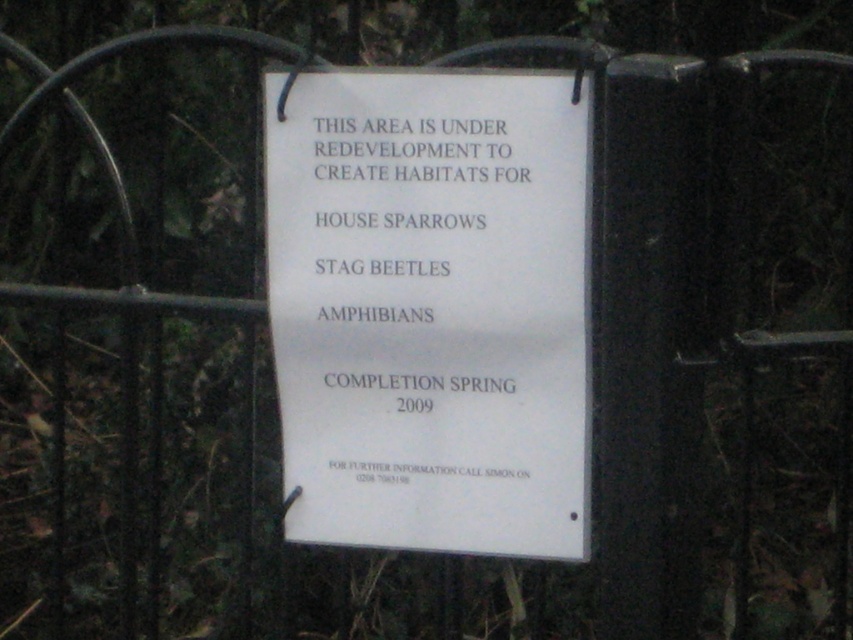
You are a contractor working on the redevelopment project mentioned on the sign. You need to attach a new notice to the fence, but you must ensure it doesn not overlap with the existing white paper sign at center or the white paper at center. Given that the new notice is 1 inch wide, what is the minimum spacing you should leave between the new notice and the existing signs to avoid overlap?

The minimum spacing required is 0.57 inches between the new notice and both the white paper sign at center and the white paper at center to prevent overlap, as the existing signs are already separated by that distance.

You are a contractor looking at the white paper sign at center and the white paper at center. Which one is closer to you?

The white paper sign at center is closer to the viewer than the white paper at center.

You are a pedestrian passing by the white paper sign at center and the white paper at center. You notice that one of them is positioned lower than the other. Which object is located lower?

The white paper sign at center is located lower than the white paper at center.